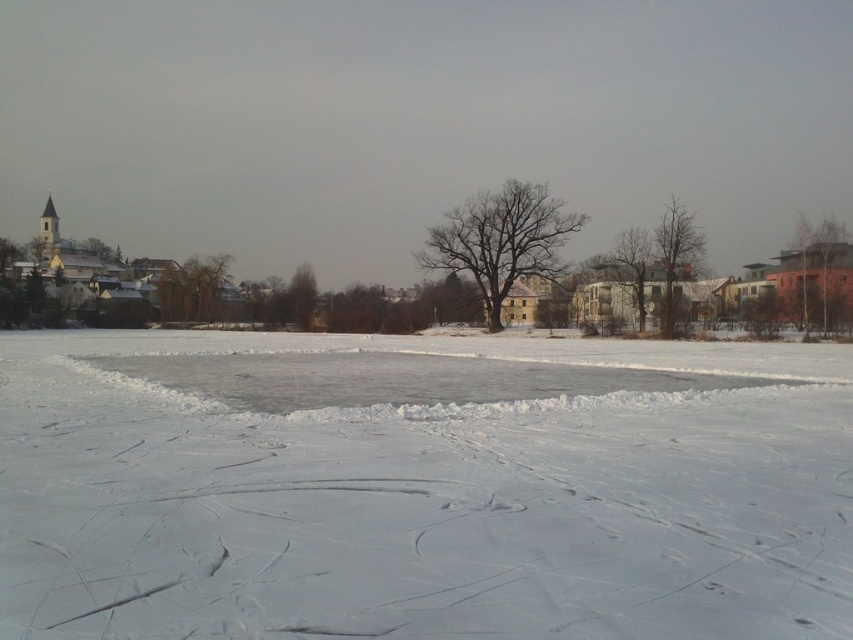
Between white powdery snow at center and bare brown tree at center, which one appears on the left side from the viewer's perspective?

white powdery snow at center is more to the left.

Who is more distant from viewer, (x=572, y=595) or (x=480, y=220)?

Positioned behind is point (x=480, y=220).

The width and height of the screenshot is (853, 640). I want to click on white powdery snow at center, so click(421, 486).

Does point (689, 253) lie behind point (306, 278)?

No, it is in front of (306, 278).

Which is more to the right, bare branches at right or brown matte tree at center?

bare branches at right

Is point (665, 218) positioned before point (300, 294)?

Yes, it is in front of point (300, 294).

Where is `bare branches at right`? bare branches at right is located at coordinates (675, 253).

Can you confirm if bare branches at center is shorter than brown matte tree at center?

No, bare branches at center is not shorter than brown matte tree at center.

Who is lower down, bare branches at center or brown matte tree at center?

brown matte tree at center is below.

Where is `bare branches at center`? This screenshot has height=640, width=853. bare branches at center is located at coordinates (635, 264).